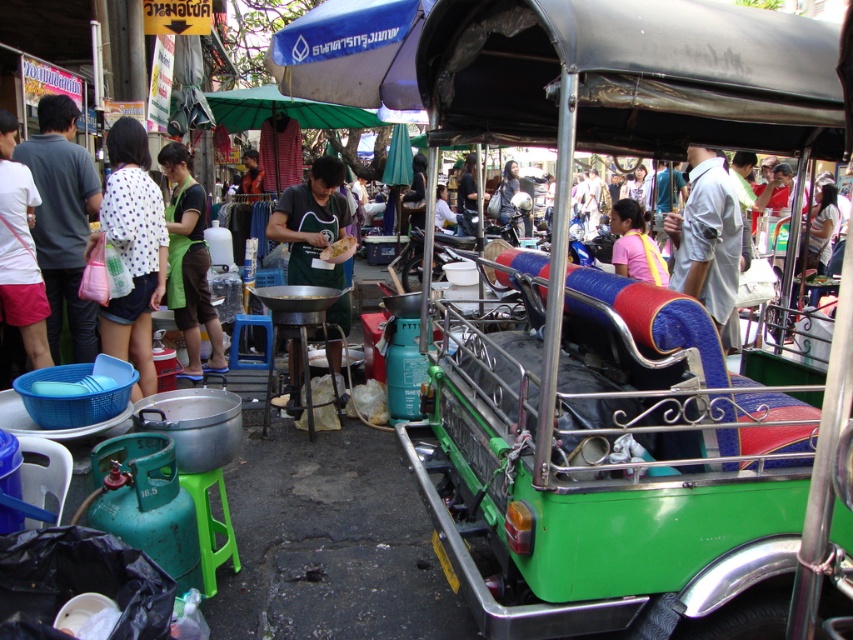
Question: Which point appears farthest from the camera in this image?

Choices:
 (A) (22, 310)
 (B) (155, 381)

Answer: (B)

Question: Does green matte apron at center have a lesser width compared to green apron at center?

Choices:
 (A) yes
 (B) no

Answer: (B)

Question: Is white dotted shirt at left in front of green apron at center?

Choices:
 (A) no
 (B) yes

Answer: (B)

Question: Estimate the real-world distances between objects in this image. Which object is farther from the green apron at center?

Choices:
 (A) white cotton shirt at left
 (B) pink fabric bag at center
 (C) green matte apron at center
 (D) white dotted shirt at left

Answer: (B)

Question: Considering the relative positions of green matte apron at center and pink fabric bag at center in the image provided, where is green matte apron at center located with respect to pink fabric bag at center?

Choices:
 (A) left
 (B) right

Answer: (A)

Question: Among these points, which one is nearest to the camera?

Choices:
 (A) (164, 269)
 (B) (0, 154)

Answer: (B)